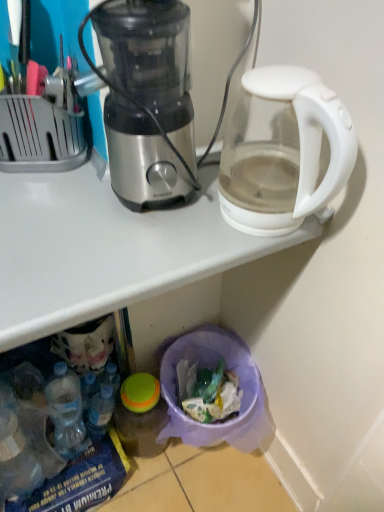
Describe the element at coordinates (106, 249) in the screenshot. The width and height of the screenshot is (384, 512). I see `transparent plastic trash bin at lower center` at that location.

What do you see at coordinates (283, 150) in the screenshot?
I see `transparent glass kettle at upper right` at bounding box center [283, 150].

Describe the element at coordinates (100, 411) in the screenshot. I see `translucent plastic bottle at lower left` at that location.

The image size is (384, 512). What do you see at coordinates (146, 98) in the screenshot?
I see `stainless steel blender at center` at bounding box center [146, 98].

At what (x,y) coordinates should I click in order to perform the action: click on stainless steel blender at center. Please return your answer as a coordinate pair (x, y). Looking at the image, I should click on (146, 98).

This screenshot has height=512, width=384. In order to click on transparent plastic trash bin at lower center in this screenshot , I will do `click(106, 249)`.

Is transparent glass kettle at upper right wider than transparent plastic trash bin at lower center?

Incorrect, the width of transparent glass kettle at upper right does not surpass that of transparent plastic trash bin at lower center.

From a real-world perspective, is transparent glass kettle at upper right physically located above or below transparent plastic trash bin at lower center?

transparent glass kettle at upper right is above transparent plastic trash bin at lower center.

Is transparent glass kettle at upper right beside transparent plastic trash bin at lower center?

They are not placed beside each other.

Does point (243, 121) come in front of point (30, 218)?

That is False.

Can you tell me how much translucent plastic bottle at lower left and translucent plastic trash can at lower center differ in facing direction?

The facing directions of translucent plastic bottle at lower left and translucent plastic trash can at lower center are 1.56 degrees apart.

Based on the photo, considering the relative sizes of translucent plastic bottle at lower left and translucent plastic trash can at lower center in the image provided, is translucent plastic bottle at lower left wider than translucent plastic trash can at lower center?

In fact, translucent plastic bottle at lower left might be narrower than translucent plastic trash can at lower center.

From a real-world perspective, is translucent plastic bottle at lower left on translucent plastic trash can at lower center?

Yes, from a real-world perspective, translucent plastic bottle at lower left is on top of translucent plastic trash can at lower center.

Choose the correct answer: Is translucent plastic bottle at lower left inside translucent plastic trash can at lower center or outside it?

translucent plastic bottle at lower left cannot be found inside translucent plastic trash can at lower center.

How many degrees apart are the facing directions of translucent plastic bottle at lower left and transparent glass kettle at upper right?

5.53 degrees.

Does point (104, 405) lie behind point (313, 138)?

Yes, it is behind point (313, 138).

From the image's perspective, which is below, translucent plastic bottle at lower left or transparent glass kettle at upper right?

From the image's view, translucent plastic bottle at lower left is below.

Between transparent glass kettle at upper right and translucent plastic bottle at lower left, which one has less height?

translucent plastic bottle at lower left is shorter.

Is transparent glass kettle at upper right directly adjacent to translucent plastic bottle at lower left?

transparent glass kettle at upper right is not next to translucent plastic bottle at lower left, and they're not touching.

Considering the relative sizes of transparent glass kettle at upper right and translucent plastic bottle at lower left in the image provided, is transparent glass kettle at upper right wider than translucent plastic bottle at lower left?

Indeed, transparent glass kettle at upper right has a greater width compared to translucent plastic bottle at lower left.

Considering the sizes of objects transparent plastic trash bin at lower center and stainless steel blender at center in the image provided, who is thinner, transparent plastic trash bin at lower center or stainless steel blender at center?

stainless steel blender at center is thinner.

Is transparent plastic trash bin at lower center in contact with stainless steel blender at center?

No, transparent plastic trash bin at lower center is not in contact with stainless steel blender at center.

From a real-world perspective, who is located higher, transparent plastic trash bin at lower center or stainless steel blender at center?

stainless steel blender at center.

Looking at the image, does transparent plastic trash bin at lower center seem bigger or smaller compared to stainless steel blender at center?

Clearly, transparent plastic trash bin at lower center is larger in size than stainless steel blender at center.

Is transparent glass kettle at upper right in contact with translucent plastic trash can at lower center?

No, transparent glass kettle at upper right is not with translucent plastic trash can at lower center.

Is transparent glass kettle at upper right oriented towards translucent plastic trash can at lower center?

No.

Does point (309, 125) appear closer or farther from the camera than point (174, 343)?

Point (309, 125).

Consider the image. From a real-world perspective, is stainless steel blender at center positioned above or below translucent plastic trash can at lower center?

Clearly, from a real-world perspective, stainless steel blender at center is above translucent plastic trash can at lower center.

From the picture: Could you measure the distance between stainless steel blender at center and translucent plastic trash can at lower center?

27.44 inches.

Which object is positioned more to the left, stainless steel blender at center or translucent plastic trash can at lower center?

stainless steel blender at center is more to the left.

Is stainless steel blender at center completely or partially outside of translucent plastic trash can at lower center?

Yes, stainless steel blender at center is located beyond the bounds of translucent plastic trash can at lower center.

Locate an element on the screen. coffee maker that is above the transparent plastic trash bin at lower center (from the image's perspective) is located at coordinates tap(283, 150).

This screenshot has height=512, width=384. In order to click on bottle above the translucent plastic trash can at lower center (from a real-world perspective) in this screenshot , I will do `click(100, 411)`.

From the image, which object appears to be nearer to stainless steel blender at center, transparent glass kettle at upper right or translucent plastic trash can at lower center?

The object closer to stainless steel blender at center is transparent glass kettle at upper right.

From the image, which object appears to be nearer to translucent plastic trash can at lower center, stainless steel blender at center or transparent glass kettle at upper right?

The object closer to translucent plastic trash can at lower center is transparent glass kettle at upper right.

Considering their positions, is stainless steel blender at center positioned closer to translucent plastic bottle at lower left than translucent plastic trash can at lower center?

translucent plastic trash can at lower center is positioned closer to the anchor translucent plastic bottle at lower left.

Based on their spatial positions, is translucent plastic bottle at lower left or stainless steel blender at center closer to translucent plastic trash can at lower center?

translucent plastic bottle at lower left is closer to translucent plastic trash can at lower center.

From the image, which object appears to be farther from transparent glass kettle at upper right, translucent plastic bottle at lower left or translucent plastic trash can at lower center?

translucent plastic bottle at lower left is positioned further to the anchor transparent glass kettle at upper right.

Which object lies nearer to the anchor point stainless steel blender at center, translucent plastic bottle at lower left or translucent plastic trash can at lower center?

translucent plastic trash can at lower center is positioned closer to the anchor stainless steel blender at center.

When comparing their distances from transparent plastic trash bin at lower center, does transparent glass kettle at upper right or translucent plastic trash can at lower center seem further?

The object further to transparent plastic trash bin at lower center is translucent plastic trash can at lower center.

Looking at the image, which one is located closer to translucent plastic trash can at lower center, stainless steel blender at center or transparent plastic trash bin at lower center?

Among the two, transparent plastic trash bin at lower center is located nearer to translucent plastic trash can at lower center.

This screenshot has width=384, height=512. What are the coordinates of `table between transparent glass kettle at upper right and translucent plastic trash can at lower center from front to back` in the screenshot? It's located at click(106, 249).

This screenshot has width=384, height=512. Find the location of `blender between transparent glass kettle at upper right and translucent plastic bottle at lower left along the z-axis`. blender between transparent glass kettle at upper right and translucent plastic bottle at lower left along the z-axis is located at coordinates (146, 98).

This screenshot has width=384, height=512. Find the location of `coffee maker that lies between stainless steel blender at center and translucent plastic trash can at lower center from top to bottom`. coffee maker that lies between stainless steel blender at center and translucent plastic trash can at lower center from top to bottom is located at coordinates (283, 150).

You are a GUI agent. You are given a task and a screenshot of the screen. Output one action in this format:
    pyautogui.click(x=<x>, y=<y>)
    Task: Click on the bottle that lies between stainless steel blender at center and translucent plastic trash can at lower center from top to bottom
    
    Given the screenshot: What is the action you would take?
    pyautogui.click(x=100, y=411)